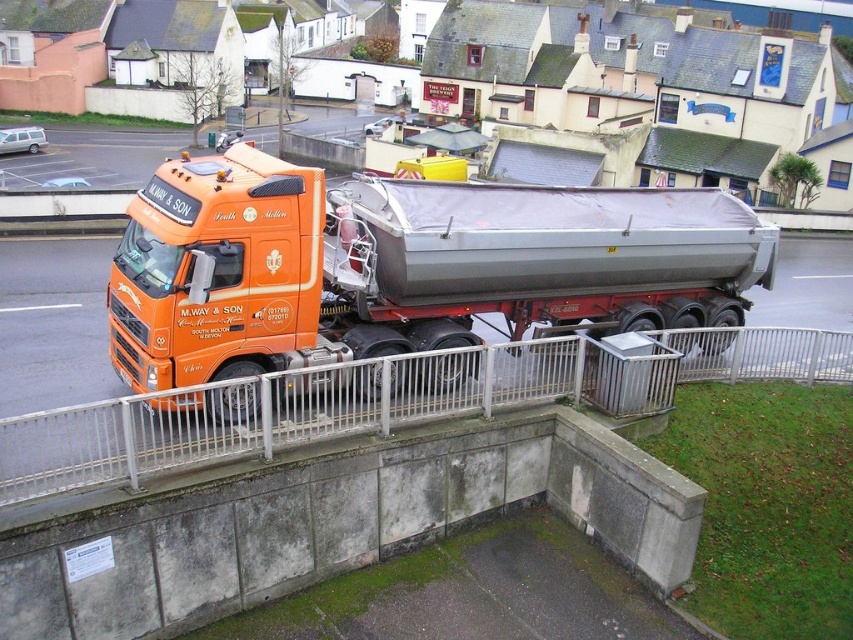
Question: Does orange matte truck at center appear on the right side of white metal rail at center?

Choices:
 (A) yes
 (B) no

Answer: (B)

Question: Which of the following is the closest to the observer?

Choices:
 (A) (189, 266)
 (B) (42, 448)

Answer: (B)

Question: Does orange matte truck at center appear on the left side of white metal rail at center?

Choices:
 (A) no
 (B) yes

Answer: (B)

Question: From the image, what is the correct spatial relationship of orange matte truck at center in relation to white metal rail at center?

Choices:
 (A) below
 (B) above

Answer: (B)